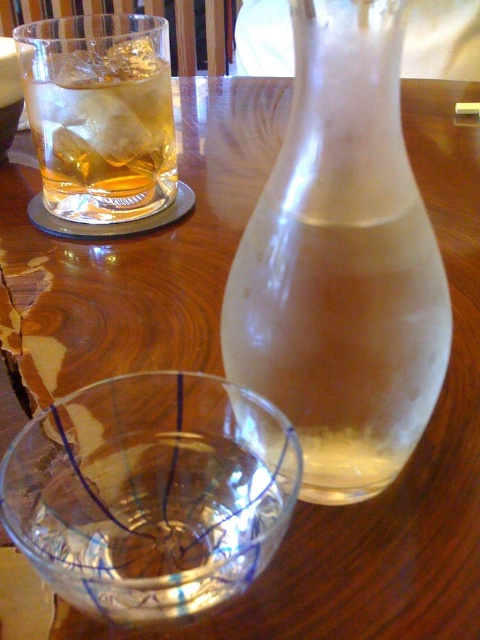
You are a guest at a dinner party and want to pour yourself a drink. You see the transparent glass carafe at center and the transparent glass bowl at center on the table. Which one should you use to pour a drink?

The transparent glass carafe at center is closer to the viewer than the transparent glass bowl at center, so you should use the transparent glass carafe at center to pour a drink since it is more accessible.

You are at a dinner party and want to pour yourself a drink. You see the transparent glass carafe at center and the amber glass at upper left. Which one is positioned to the right of the other?

The transparent glass carafe at center is positioned to the right of the amber glass at upper left.

You are a guest at a dinner party and see the transparent glass carafe at center and the transparent glass bowl at center on the table. Which one is placed higher up?

The transparent glass carafe at center is placed higher up than the transparent glass bowl at center.